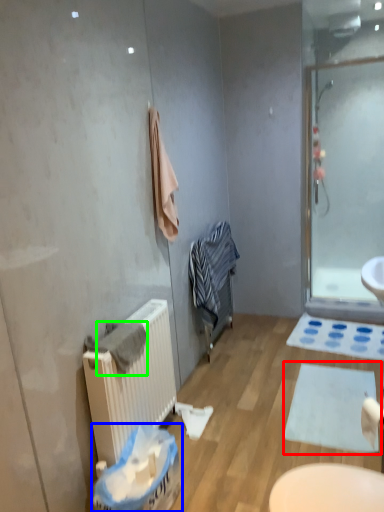
Question: Which object is positioned closest to bath mat (highlighted by a red box)? Select from laundry basket (highlighted by a blue box) and bath towel (highlighted by a green box).

Choices:
 (A) laundry basket
 (B) bath towel

Answer: (A)